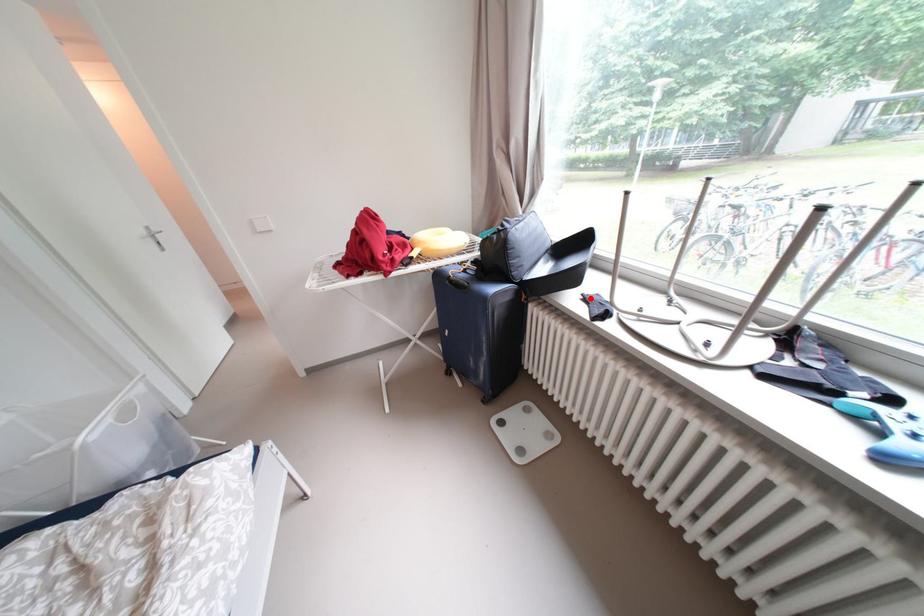
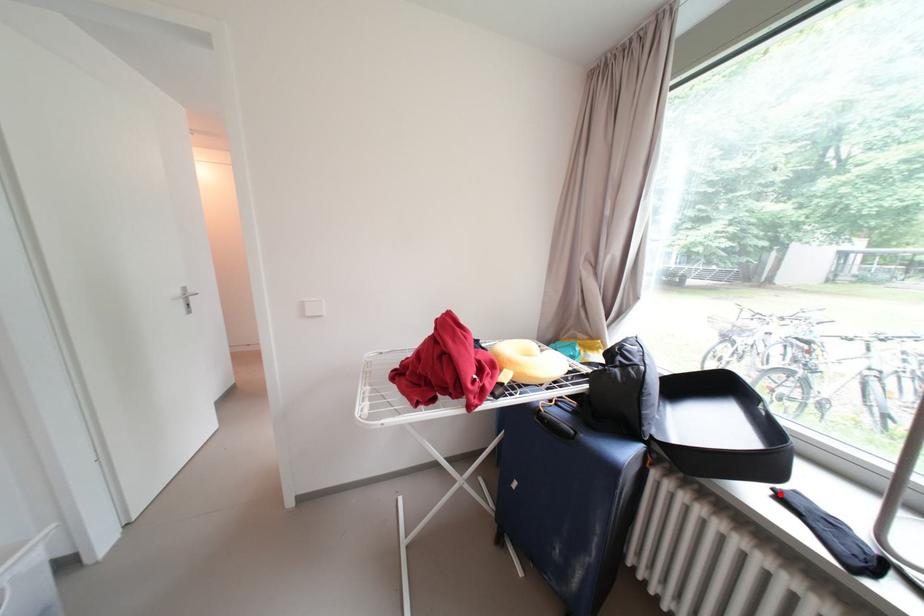
I am providing you with two images of the same scene from different viewpoints. A red point is marked on the first image and another point is marked on the second image. Does the point marked in image1 correspond to the same location as the one in image2?

Yes